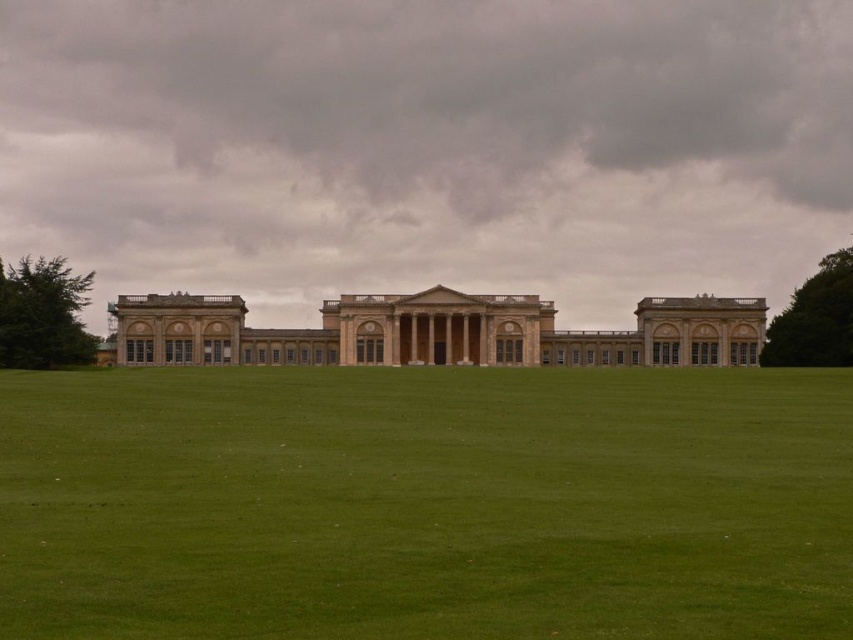
You are standing in the formal garden looking at the classical building. There are two points marked on the building facade. The first point is at coordinates point (26,508) and the second is at point (346,349). Which point appears closer to you?

Point (26,508) is closer to the camera than point (346,349), so the first point appears closer to you.